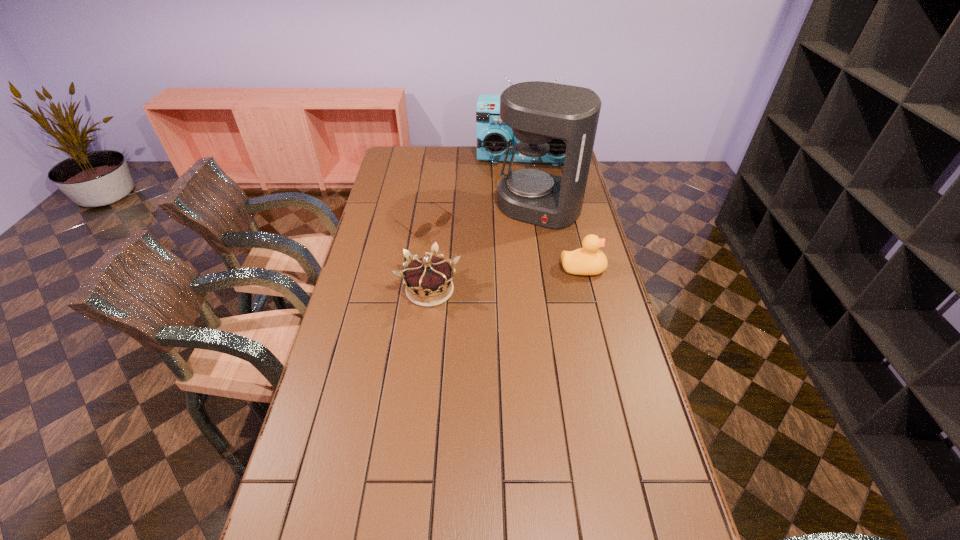
The width and height of the screenshot is (960, 540). I want to click on vacant region that satisfies the following two spatial constraints: 1. on the front side of the sunglasses; 2. on the face of the duck, so point(417,268).

The image size is (960, 540). What are the coordinates of `vacant region that satisfies the following two spatial constraints: 1. on the front side of the crown; 2. on the left side of the shortest object` in the screenshot? It's located at click(414, 290).